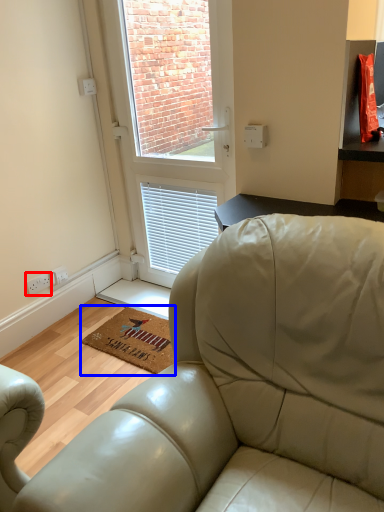
Question: Which object appears farthest to the camera in this image, electric outlet (highlighted by a red box) or mat (highlighted by a blue box)?

Choices:
 (A) electric outlet
 (B) mat

Answer: (A)